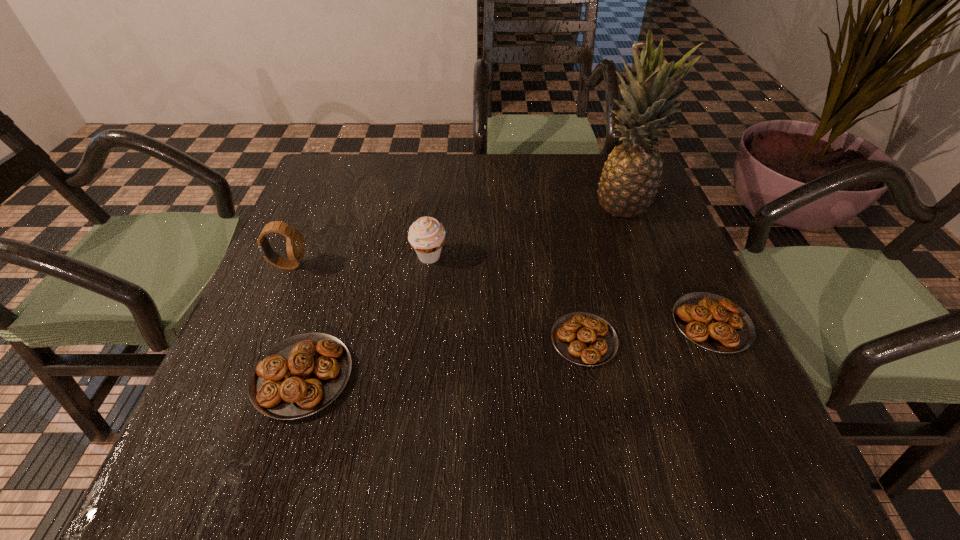
To achieve even spacing by inserting another pastry among them, please point to a vacant spot for this new pastry. Please provide its 2D coordinates. Your answer should be formatted as a tuple, i.e. [(x, y)], where the tuple contains the x and y coordinates of a point satisfying the conditions above.

[(448, 357)]